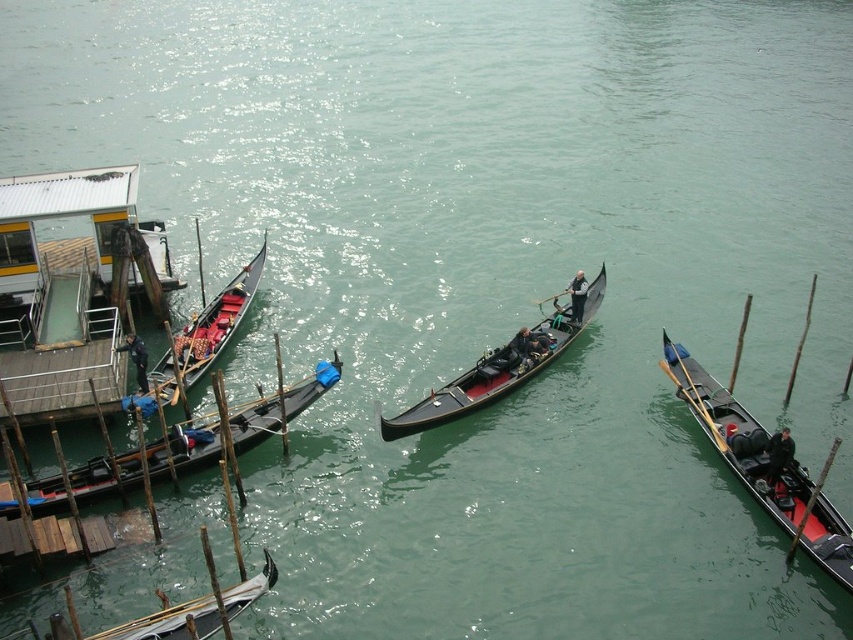
Based on the photo, measure the distance between point (694, 388) and camera.

The distance of point (694, 388) from camera is 31.88 meters.

Is black polished gondola at right to the right of dark blue leather jacket at lower right from the viewer's perspective?

In fact, black polished gondola at right is to the left of dark blue leather jacket at lower right.

Which is behind, point (815, 522) or point (769, 474)?

Positioned behind is point (769, 474).

Image resolution: width=853 pixels, height=640 pixels. What are the coordinates of `black polished gondola at right` in the screenshot? It's located at (761, 465).

Which of these two, dark blue fabric jacket at left or wooden paddle at right, stands shorter?

With less height is dark blue fabric jacket at left.

Can you confirm if dark blue fabric jacket at left is taller than wooden paddle at right?

In fact, dark blue fabric jacket at left may be shorter than wooden paddle at right.

Between point (140, 355) and point (683, 394), which one is positioned behind?

Positioned behind is point (683, 394).

Locate an element on the screen. dark blue fabric jacket at left is located at coordinates (136, 358).

Does wooden gondola at center appear on the right side of dark brown wooden paddle at center?

→ In fact, wooden gondola at center is to the left of dark brown wooden paddle at center.

What do you see at coordinates (531, 348) in the screenshot? This screenshot has width=853, height=640. I see `wooden gondola at center` at bounding box center [531, 348].

Which is in front, point (550, 337) or point (572, 320)?

Point (550, 337) is more forward.

Locate an element on the screen. The height and width of the screenshot is (640, 853). wooden gondola at center is located at coordinates (531, 348).